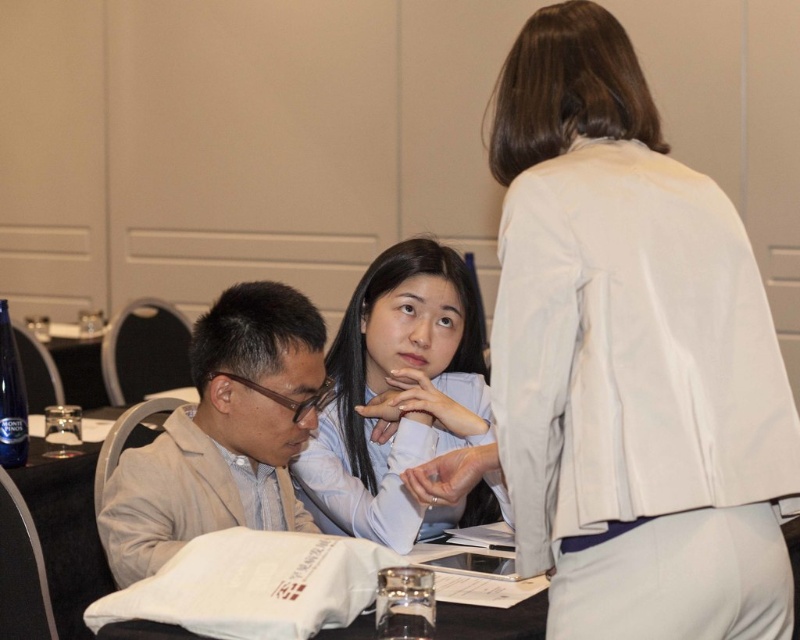
Question: Which object appears farthest from the camera in this image?

Choices:
 (A) white fabric jacket at upper right
 (B) beige fabric suit at left
 (C) white paper bag at lower center
 (D) light blue shirt at center

Answer: (D)

Question: Which point is closer to the camera?

Choices:
 (A) light blue shirt at center
 (B) white fabric jacket at upper right
 (C) white paper bag at lower center
 (D) beige fabric suit at left

Answer: (B)

Question: Can you confirm if light blue shirt at center is wider than white paper bag at lower center?

Choices:
 (A) no
 (B) yes

Answer: (A)

Question: Does white fabric jacket at upper right appear under light blue shirt at center?

Choices:
 (A) no
 (B) yes

Answer: (A)

Question: Can you confirm if white fabric jacket at upper right is wider than white paper bag at lower center?

Choices:
 (A) no
 (B) yes

Answer: (A)

Question: Which object is the farthest from the light blue shirt at center?

Choices:
 (A) beige fabric suit at left
 (B) white paper bag at lower center

Answer: (B)